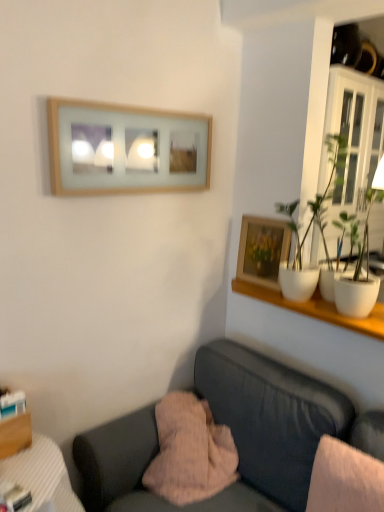
Question: Considering the positions of point (317, 318) and point (258, 367), is point (317, 318) closer or farther from the camera than point (258, 367)?

Choices:
 (A) closer
 (B) farther

Answer: (A)

Question: In terms of height, does white glossy shelf at upper right look taller or shorter compared to velvet dark gray couch at lower center?

Choices:
 (A) short
 (B) tall

Answer: (A)

Question: Which object is the closest to the white glossy cabinet at upper right?

Choices:
 (A) wooden picture frame at upper right, marked as the second picture frame in a left-to-right arrangement
 (B) white glossy shelf at upper right
 (C) velvet dark gray couch at lower center
 (D) pink fuzzy pillow at lower center
 (E) wooden frame at upper center, the 2th picture frame in the bottom-to-top sequence

Answer: (A)

Question: Considering the real-world distances, which object is farthest from the white glossy shelf at upper right?

Choices:
 (A) wooden frame at upper center, the 2th picture frame in the bottom-to-top sequence
 (B) wooden picture frame at upper right, the first picture frame positioned from the bottom
 (C) velvet dark gray couch at lower center
 (D) pink fuzzy pillow at lower center
 (E) white glossy cabinet at upper right

Answer: (A)